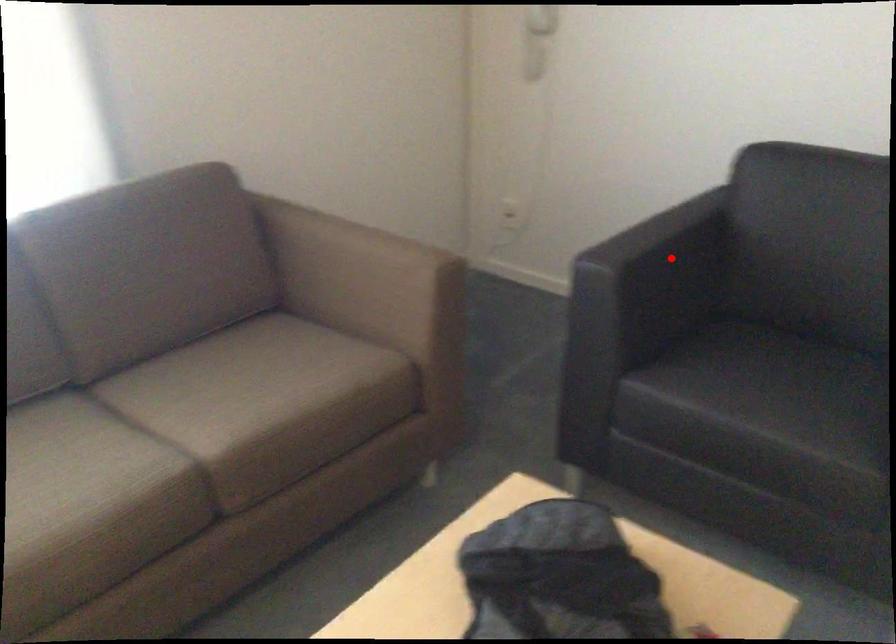
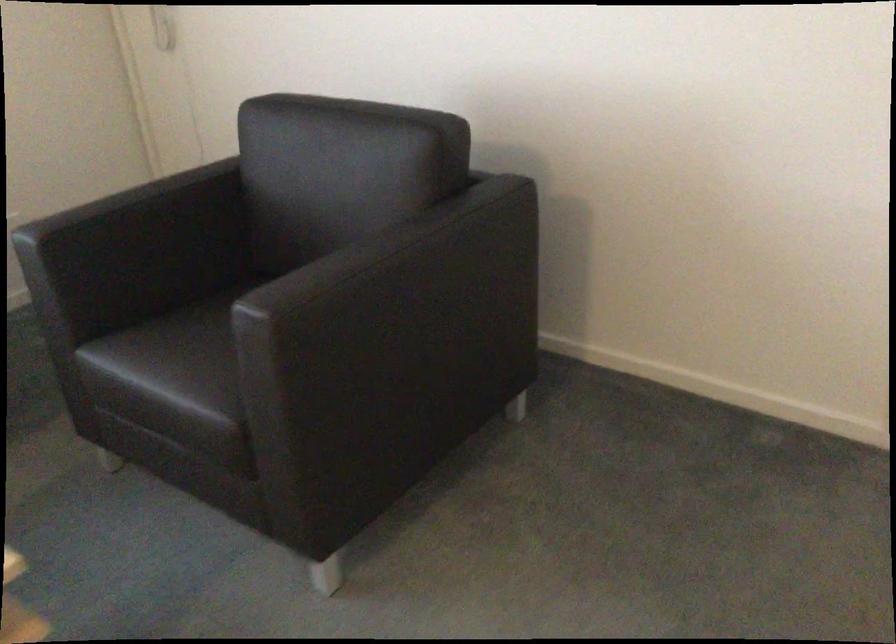
Where in the second image is the point corresponding to the highlighted location from the first image?

(147, 225)